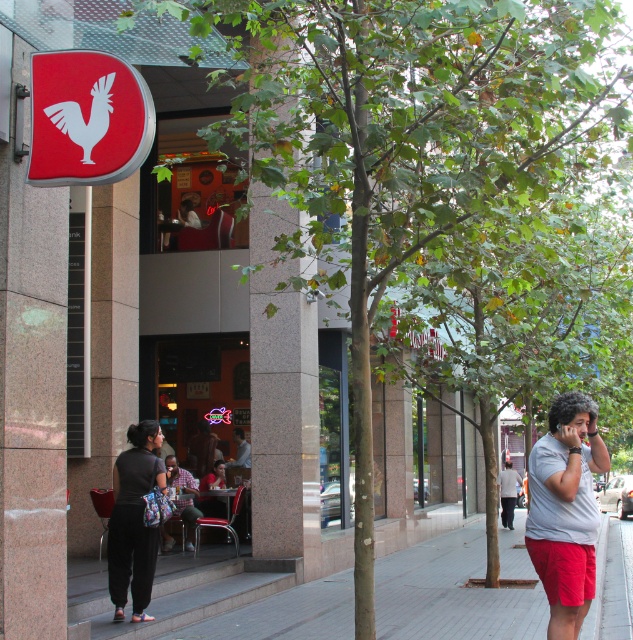
You are a delivery person standing on the sidewalk in front of the restaurant. You need to place a heavy box on the concrete pavement at lower left without blocking the dark gray fabric pants at lower left. Is this possible given their positions?

The concrete pavement at lower left is positioned on the right side of dark gray fabric pants at lower left. Therefore, placing the box on the concrete pavement at lower left to the right of the dark gray fabric pants at lower left would not block them.

You are standing at the entrance of the restaurant and want to walk to the concrete pavement at lower left. According to the coordinates provided, in which direction should you move relative to the restaurant entrance?

The concrete pavement at lower left is located at point (451, 595), which means it is positioned to the lower left of the restaurant entrance. You should move in the lower left direction from the entrance to reach it.

You are a photographer standing on the sidewalk. You want to take a photo of the dark gray fabric pants at lower left and the smooth skin man at center. Which one will appear larger in the photo?

The dark gray fabric pants at lower left will appear larger in the photo because they are taller than the smooth skin man at center.